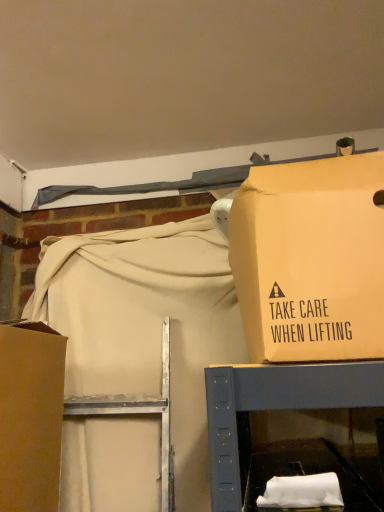
Question: From the image's perspective, is matte cardboard box at upper right, which is counted as the 1th box, starting from the right, positioned above or below brown cardboard box at left, the second box from the right?

Choices:
 (A) above
 (B) below

Answer: (A)

Question: Looking at their shapes, would you say matte cardboard box at upper right, which is counted as the 1th box, starting from the right, is wider or thinner than brown cardboard box at left, which appears as the first box when viewed from the left?

Choices:
 (A) thin
 (B) wide

Answer: (B)

Question: From a real-world perspective, is matte cardboard box at upper right, which is counted as the 1th box, starting from the right, physically located above or below brown cardboard box at left, which appears as the first box when viewed from the left?

Choices:
 (A) above
 (B) below

Answer: (A)

Question: In terms of width, does brown cardboard box at left, the second box from the right, look wider or thinner when compared to matte cardboard box at upper right, which is counted as the 1th box, starting from the right?

Choices:
 (A) thin
 (B) wide

Answer: (A)

Question: From their relative heights in the image, would you say brown cardboard box at left, which appears as the first box when viewed from the left, is taller or shorter than matte cardboard box at upper right, which is counted as the 1th box, starting from the right?

Choices:
 (A) short
 (B) tall

Answer: (B)

Question: Would you say brown cardboard box at left, the second box from the right, is to the left or to the right of matte cardboard box at upper right, which ranks as the second box in left-to-right order, in the picture?

Choices:
 (A) right
 (B) left

Answer: (B)

Question: Is brown cardboard box at left, which appears as the first box when viewed from the left, inside the boundaries of matte cardboard box at upper right, which is counted as the 1th box, starting from the right, or outside?

Choices:
 (A) inside
 (B) outside

Answer: (B)